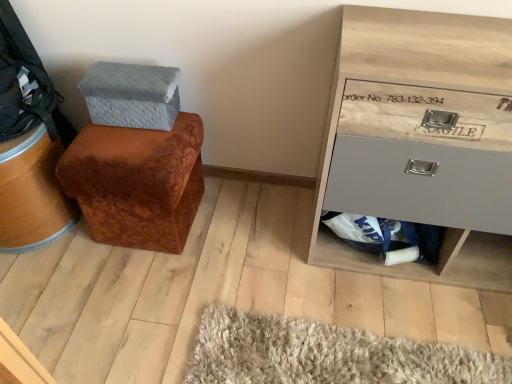
Where is `textured gray shoe box at upper left`? Image resolution: width=512 pixels, height=384 pixels. textured gray shoe box at upper left is located at coordinates (131, 95).

From a real-world perspective, which is physically above, wooden drawer at right or brown velvety ottoman at left?

From a 3D spatial view, wooden drawer at right is above.

Is wooden drawer at right bigger than brown velvety ottoman at left?

Yes.

Is wooden drawer at right turned away from brown velvety ottoman at left?

No, wooden drawer at right is not facing the opposite direction of brown velvety ottoman at left.

Based on the photo, is brown velvety ottoman at left next to wooden drawer at right?

No, brown velvety ottoman at left is not making contact with wooden drawer at right.

Which of these two, brown velvety ottoman at left or wooden drawer at right, stands shorter?

brown velvety ottoman at left.

Is brown velvety ottoman at left spatially inside wooden drawer at right, or outside of it?

brown velvety ottoman at left exists outside the volume of wooden drawer at right.

Between brown velvety ottoman at left and wooden drawer at right, which one has smaller size?

With smaller size is brown velvety ottoman at left.

Could you tell me if wooden drawer at right is turned towards textured gray shoe box at upper left?

No, wooden drawer at right does not turn towards textured gray shoe box at upper left.

Is point (360, 56) closer or farther from the camera than point (89, 110)?

Clearly, point (360, 56) is closer to the camera than point (89, 110).

From the image's perspective, is wooden drawer at right beneath textured gray shoe box at upper left?

Yes.

Which object is further away from the camera, wooden drawer at right or textured gray shoe box at upper left?

textured gray shoe box at upper left is further away from the camera.

Based on their positions, is brown velvety ottoman at left located to the left or right of textured gray shoe box at upper left?

Based on their positions, brown velvety ottoman at left is located to the right of textured gray shoe box at upper left.

Which object is thinner, brown velvety ottoman at left or textured gray shoe box at upper left?

textured gray shoe box at upper left.

Are brown velvety ottoman at left and textured gray shoe box at upper left beside each other?

brown velvety ottoman at left is not next to textured gray shoe box at upper left, and they're not touching.

From the picture: Which of these two, textured gray shoe box at upper left or brown velvety ottoman at left, stands taller?

brown velvety ottoman at left.

This screenshot has height=384, width=512. In order to click on furniture lying in front of the textured gray shoe box at upper left in this screenshot , I will do `click(137, 182)`.

Which object is positioned more to the left, textured gray shoe box at upper left or brown velvety ottoman at left?

textured gray shoe box at upper left.

Is textured gray shoe box at upper left thinner than brown velvety ottoman at left?

Yes.

Who is shorter, textured gray shoe box at upper left or wooden drawer at right?

Standing shorter between the two is textured gray shoe box at upper left.

Is textured gray shoe box at upper left positioned before wooden drawer at right?

No, the depth of textured gray shoe box at upper left is greater than that of wooden drawer at right.

Is textured gray shoe box at upper left wider or thinner than wooden drawer at right?

textured gray shoe box at upper left is thinner than wooden drawer at right.

Which object is positioned more to the left, textured gray shoe box at upper left or wooden drawer at right?

textured gray shoe box at upper left is more to the left.

Where is `furniture below the wooden drawer at right (from the image's perspective)`? furniture below the wooden drawer at right (from the image's perspective) is located at coordinates (137, 182).

Image resolution: width=512 pixels, height=384 pixels. In order to click on furniture behind the wooden drawer at right in this screenshot , I will do `click(137, 182)`.

When comparing their distances from brown velvety ottoman at left, does wooden drawer at right or textured gray shoe box at upper left seem closer?

textured gray shoe box at upper left.

Estimate the real-world distances between objects in this image. Which object is further from brown velvety ottoman at left, textured gray shoe box at upper left or wooden drawer at right?

wooden drawer at right is positioned further to the anchor brown velvety ottoman at left.

When comparing their distances from textured gray shoe box at upper left, does wooden drawer at right or brown velvety ottoman at left seem closer?

Based on the image, brown velvety ottoman at left appears to be nearer to textured gray shoe box at upper left.

When comparing their distances from textured gray shoe box at upper left, does brown velvety ottoman at left or wooden drawer at right seem further?

wooden drawer at right is positioned further to the anchor textured gray shoe box at upper left.

Looking at the image, which one is located further to wooden drawer at right, textured gray shoe box at upper left or brown velvety ottoman at left?

textured gray shoe box at upper left is positioned further to the anchor wooden drawer at right.

Estimate the real-world distances between objects in this image. Which object is further from wooden drawer at right, brown velvety ottoman at left or textured gray shoe box at upper left?

textured gray shoe box at upper left.

Find the location of a particular element. This screenshot has width=512, height=384. furniture located between textured gray shoe box at upper left and wooden drawer at right in the left-right direction is located at coordinates [137, 182].